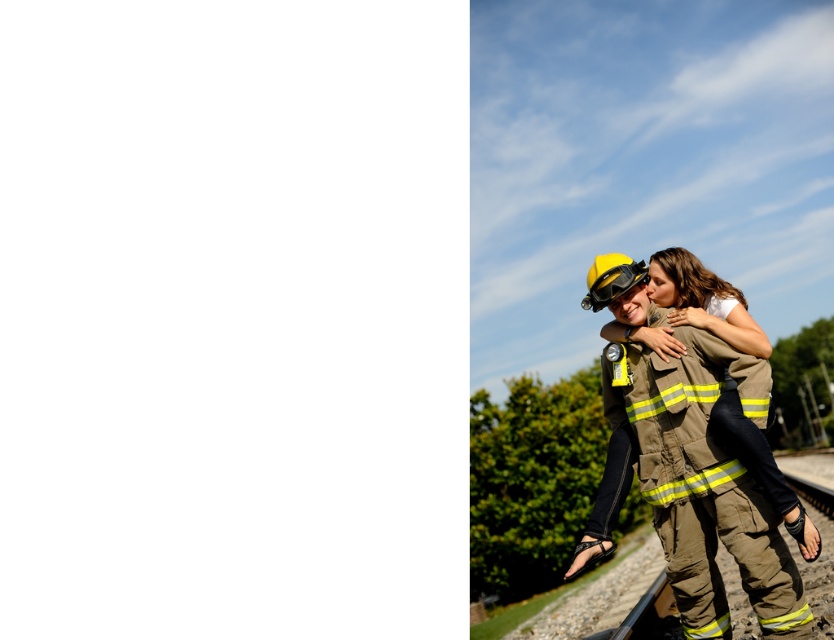
Which is above, brown fireman uniform at right or yellow matte safety goggles at center?

yellow matte safety goggles at center

The image size is (834, 640). Describe the element at coordinates (704, 481) in the screenshot. I see `brown fireman uniform at right` at that location.

Is point (737, 387) positioned before point (642, 276)?

Yes, it is in front of point (642, 276).

At what (x,y) coordinates should I click in order to perform the action: click on brown fireman uniform at right. Please return your answer as a coordinate pair (x, y). The height and width of the screenshot is (640, 834). Looking at the image, I should click on (704, 481).